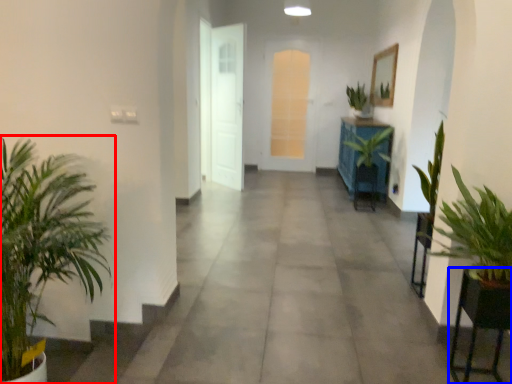
Question: Among these objects, which one is farthest to the camera, houseplant (highlighted by a red box) or furniture (highlighted by a blue box)?

Choices:
 (A) houseplant
 (B) furniture

Answer: (B)